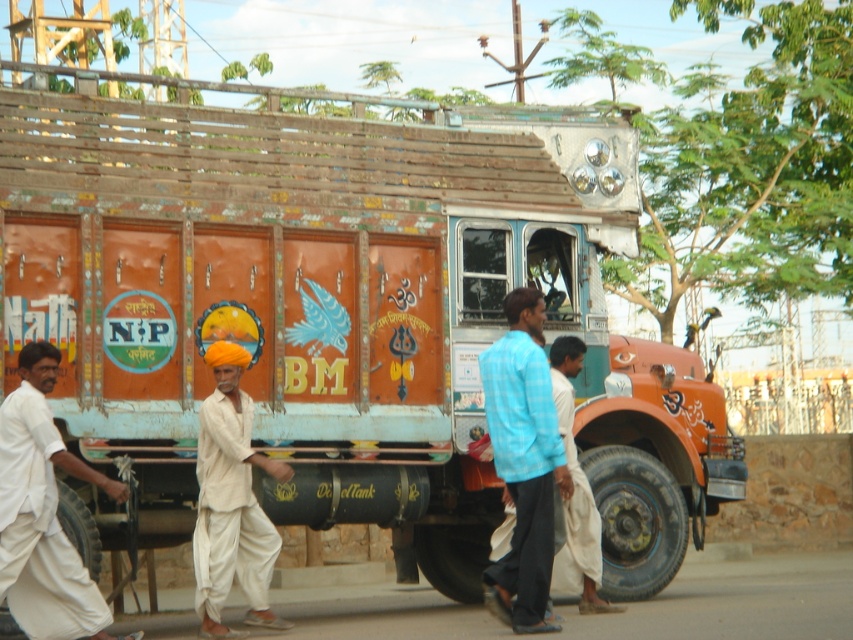
Question: Based on their relative distances, which object is farther from the white cotton turban at left?

Choices:
 (A) blue plaid shirt at lower center
 (B) white cotton turban at center

Answer: (A)

Question: Is blue plaid shirt at lower center behind white cotton turban at center?

Choices:
 (A) yes
 (B) no

Answer: (B)

Question: Which of these objects is positioned closest to the blue plaid shirt at lower center?

Choices:
 (A) white cotton turban at left
 (B) white cotton turban at center

Answer: (B)

Question: Which point appears farthest from the camera in this image?

Choices:
 (A) (500, 384)
 (B) (239, 516)

Answer: (B)

Question: Can you confirm if white cotton turban at left is positioned to the right of blue plaid shirt at lower center?

Choices:
 (A) no
 (B) yes

Answer: (A)

Question: Does white cotton turban at left lie behind white cotton turban at center?

Choices:
 (A) no
 (B) yes

Answer: (A)